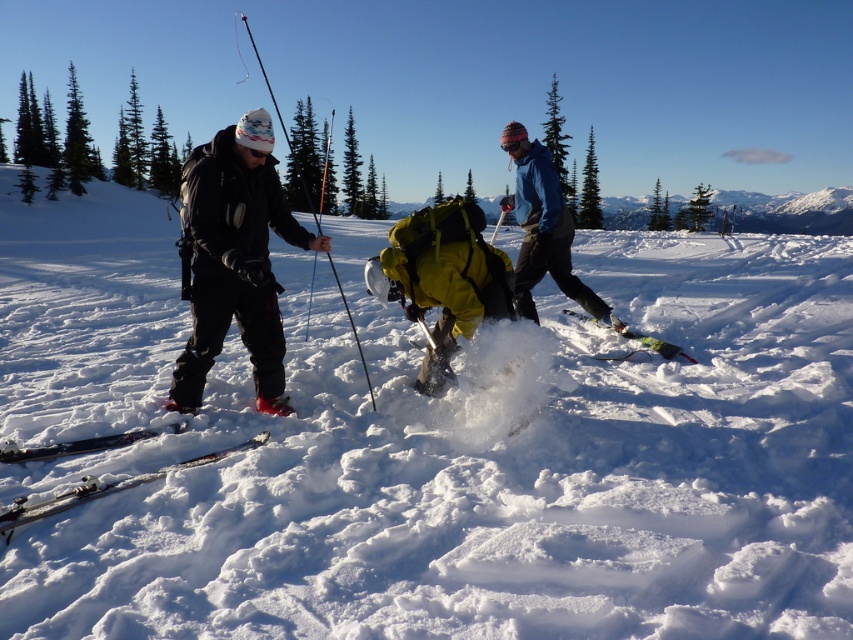
Is point (575, 477) positioned in front of point (308, 196)?

Yes, it is in front of point (308, 196).

Who is more forward, (16, 362) or (212, 168)?

Point (212, 168)

At what (x,y) coordinates should I click in order to perform the action: click on white fluffy snow at center. Please return your answer as a coordinate pair (x, y). The height and width of the screenshot is (640, 853). Looking at the image, I should click on (491, 468).

Can you confirm if matte black jacket at center is thinner than shiny black skis at lower left?

Incorrect, matte black jacket at center's width is not less than shiny black skis at lower left's.

The width and height of the screenshot is (853, 640). I want to click on matte black jacket at center, so click(234, 259).

Is white fluffy snow at center to the left of shiny black skis at lower left from the viewer's perspective?

Correct, you'll find white fluffy snow at center to the left of shiny black skis at lower left.

Describe the element at coordinates (491, 468) in the screenshot. I see `white fluffy snow at center` at that location.

You are a GUI agent. You are given a task and a screenshot of the screen. Output one action in this format:
    pyautogui.click(x=<x>, y=<y>)
    Task: Click on the white fluffy snow at center
    This screenshot has width=853, height=640.
    Given the screenshot: What is the action you would take?
    pyautogui.click(x=491, y=468)